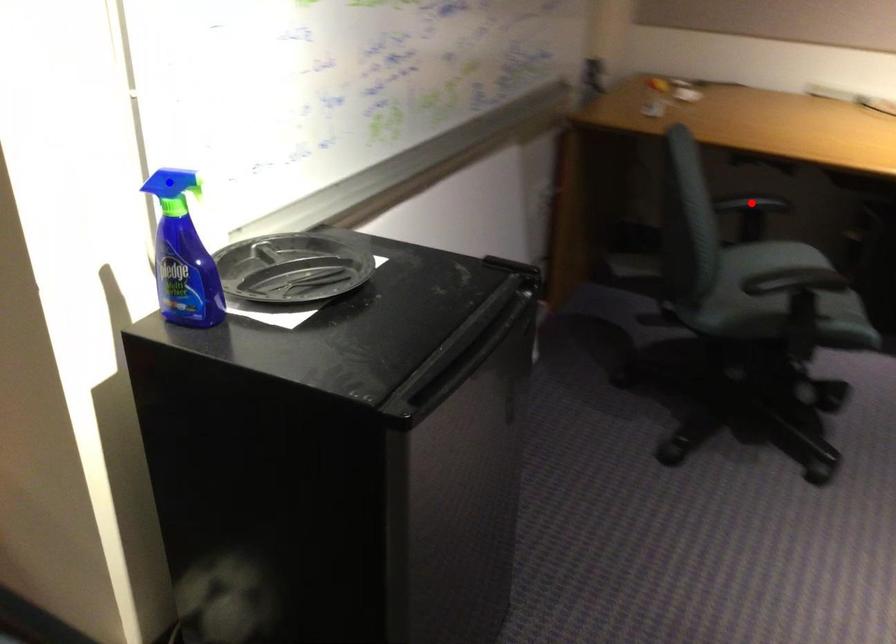
Question: Two points are marked on the image. Which point is closer to the camera?

Choices:
 (A) Blue point is closer.
 (B) Red point is closer.

Answer: (A)